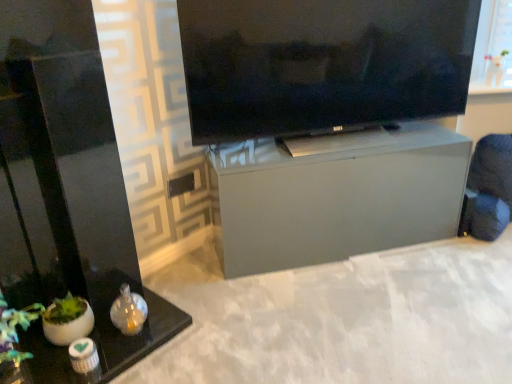
I want to click on unoccupied region to the right of black glass table at lower left, arranged as the first furniture when viewed from the front, so click(216, 332).